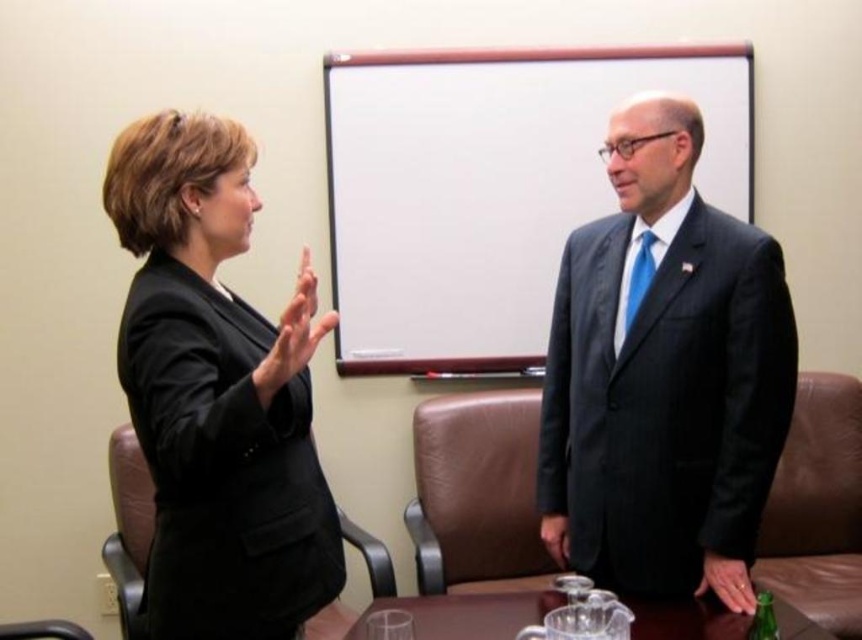
Question: Which point is farther to the camera?

Choices:
 (A) (479, 628)
 (B) (230, 451)

Answer: (A)

Question: Considering the relative positions of dark blue suit at right and clear glass table at center in the image provided, where is dark blue suit at right located with respect to clear glass table at center?

Choices:
 (A) above
 (B) below

Answer: (A)

Question: Can you confirm if white matte projection screen at upper center is wider than black matte suit at left?

Choices:
 (A) no
 (B) yes

Answer: (B)

Question: Which point appears farthest from the camera in this image?

Choices:
 (A) (656, 109)
 (B) (366, 253)

Answer: (B)

Question: Which point is closer to the camera?

Choices:
 (A) clear glass table at center
 (B) dark blue suit at right

Answer: (A)

Question: In this image, where is black matte suit at left located relative to clear glass table at center?

Choices:
 (A) below
 (B) above

Answer: (B)